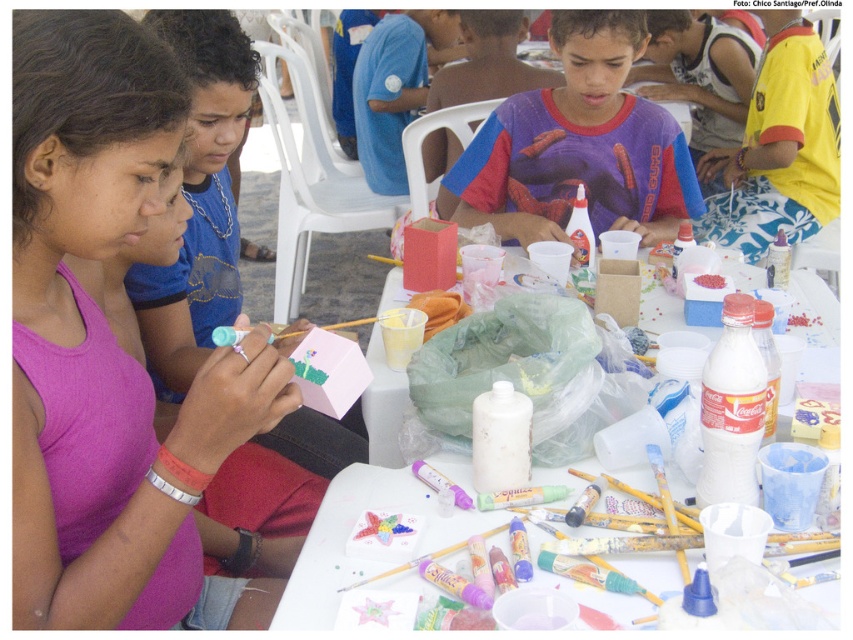
Question: Is white plastic table at center positioned in front of blue cotton shirt at upper center?

Choices:
 (A) no
 (B) yes

Answer: (B)

Question: Which of these objects is positioned closest to the white plastic table at center?

Choices:
 (A) purple matte shirt at center
 (B) matte pink paper at center

Answer: (B)

Question: Considering the real-world distances, which object is closest to the blue cotton shirt at upper center?

Choices:
 (A) white plastic table at center
 (B) pink matte tank top at center
 (C) yellow fabric shorts at right

Answer: (C)

Question: Which object is closer to the camera taking this photo?

Choices:
 (A) blue cotton shirt at upper center
 (B) spiderman t-shirt at center
 (C) purple matte shirt at center

Answer: (C)

Question: Does matte pink paper at center lie behind white plastic table at center?

Choices:
 (A) no
 (B) yes

Answer: (B)

Question: Does pink matte tank top at center have a lesser width compared to yellow fabric shorts at right?

Choices:
 (A) no
 (B) yes

Answer: (B)